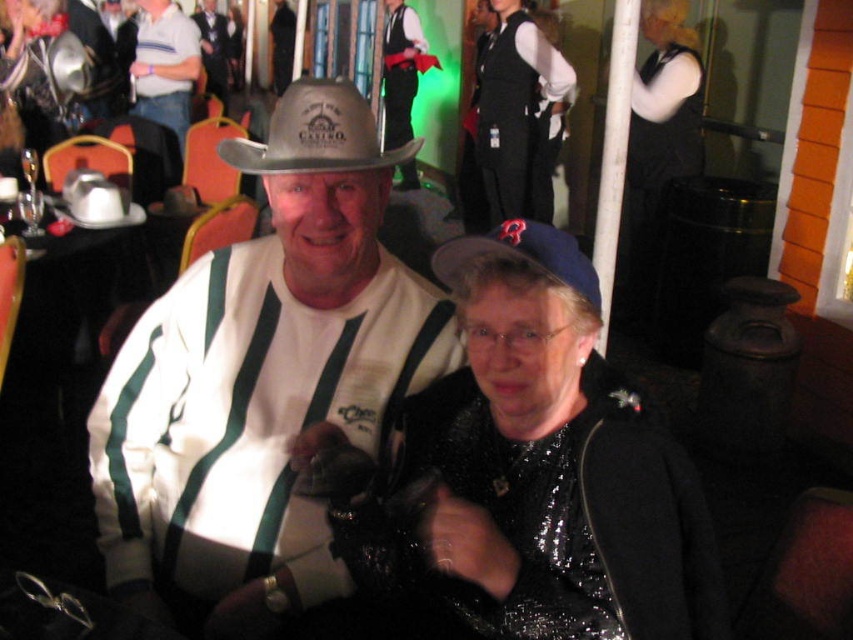
Question: Estimate the real-world distances between objects in this image. Which object is farther from the blue fabric cap at center?

Choices:
 (A) white matte cowboy hat at center
 (B) gray felt cowboy hat at center

Answer: (A)

Question: Can you confirm if white striped shirt at upper left is positioned below blue fabric cap at center?

Choices:
 (A) yes
 (B) no

Answer: (B)

Question: Among these points, which one is farthest from the camera?

Choices:
 (A) (511, 257)
 (B) (294, 166)

Answer: (B)

Question: Can you confirm if shiny black jacket at center is wider than blue fabric cap at center?

Choices:
 (A) yes
 (B) no

Answer: (A)

Question: Can you confirm if blue fabric cap at center is thinner than matte black cowboy hat at upper center?

Choices:
 (A) no
 (B) yes

Answer: (B)

Question: Which object is closer to the camera taking this photo?

Choices:
 (A) shiny black jacket at center
 (B) matte black cowboy hat at upper center
 (C) blue fabric cap at center
 (D) white matte cowboy hat at center

Answer: (A)